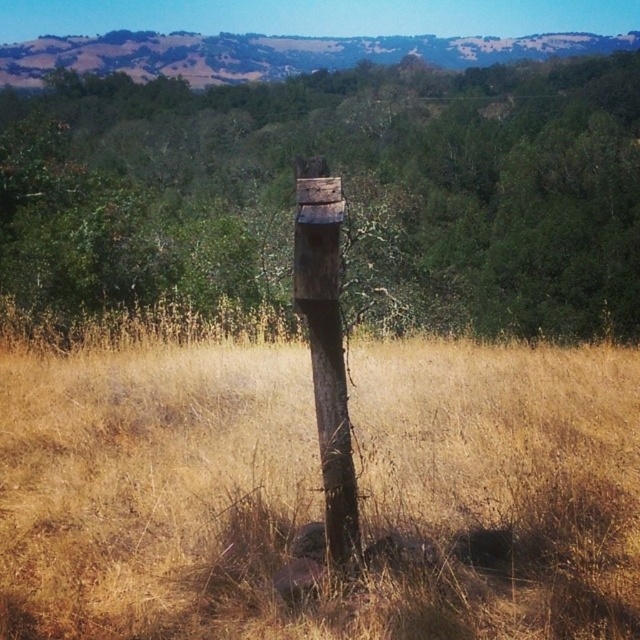
Who is lower down, dry grass at center or weathered wood post at center?

dry grass at center is lower down.

Is point (579, 433) positioned behind point (339, 465)?

Yes, point (579, 433) is behind point (339, 465).

Does point (176, 560) come in front of point (324, 355)?

No, (176, 560) is behind (324, 355).

The width and height of the screenshot is (640, 640). What are the coordinates of `dry grass at center` in the screenshot? It's located at (310, 484).